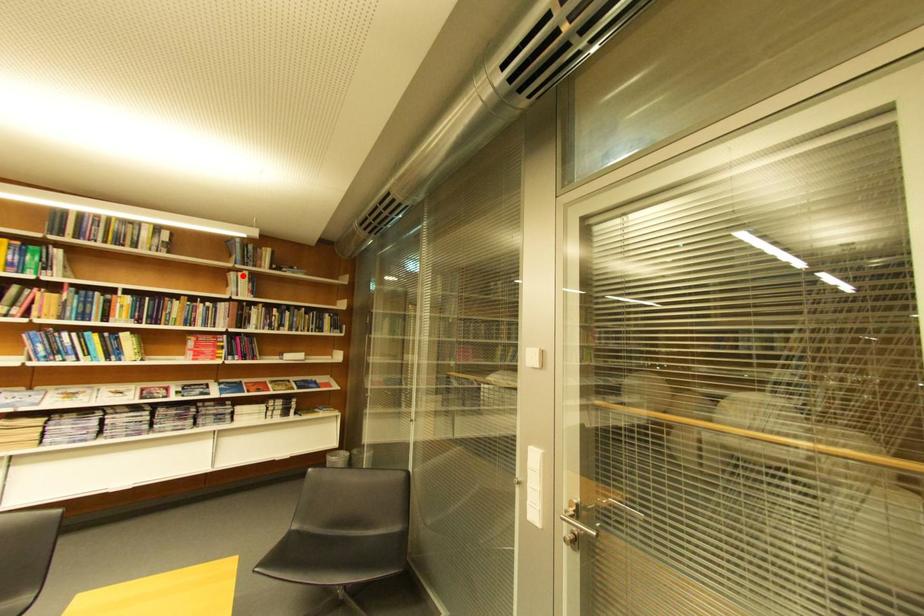
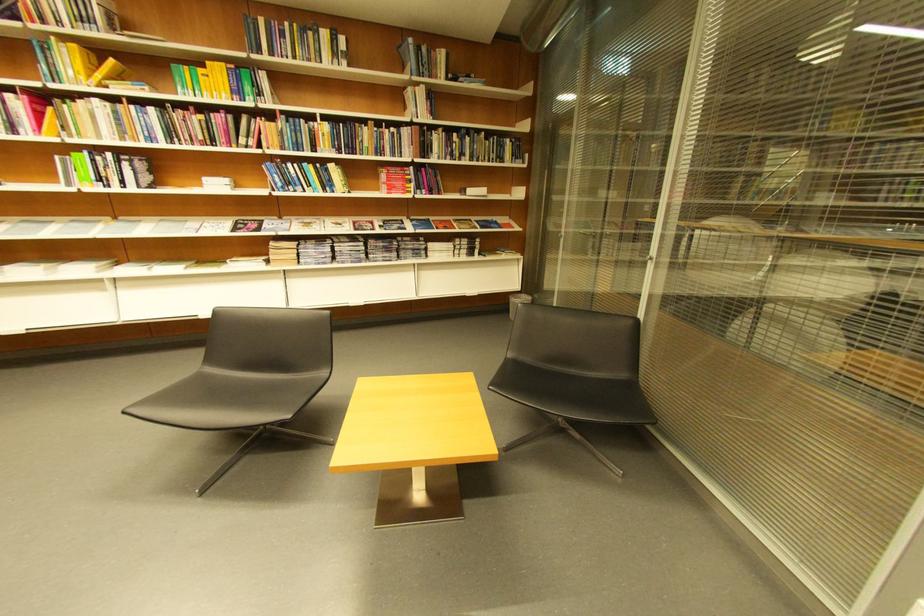
The point at the highlighted location is marked in the first image. Where is the corresponding point in the second image?

(419, 91)